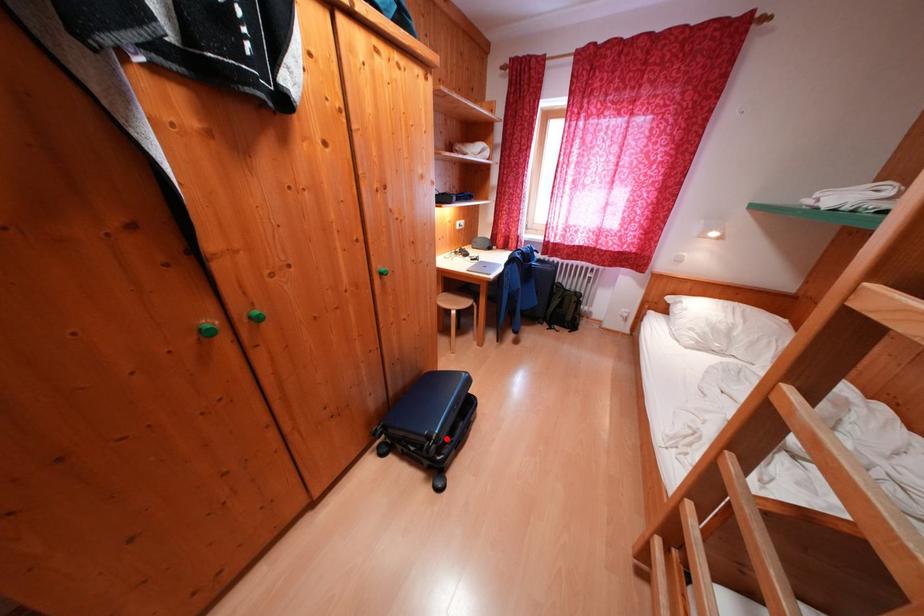
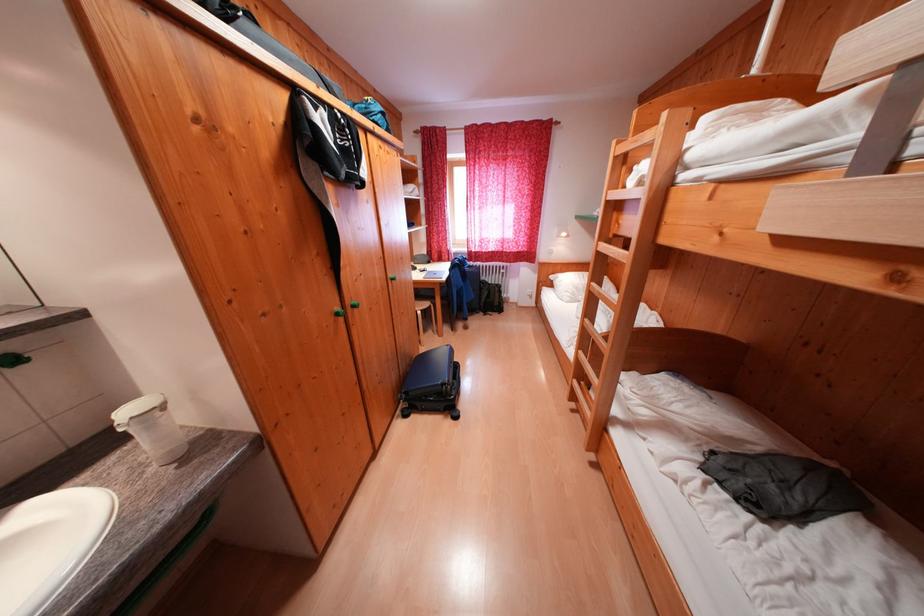
Question: A red point is marked in image1. In image2, is the corresponding 3D point closer to the camera or farther? Reply with the corresponding letter.

Choices:
 (A) The corresponding 3D point is closer.
 (B) The corresponding 3D point is farther.

Answer: (A)